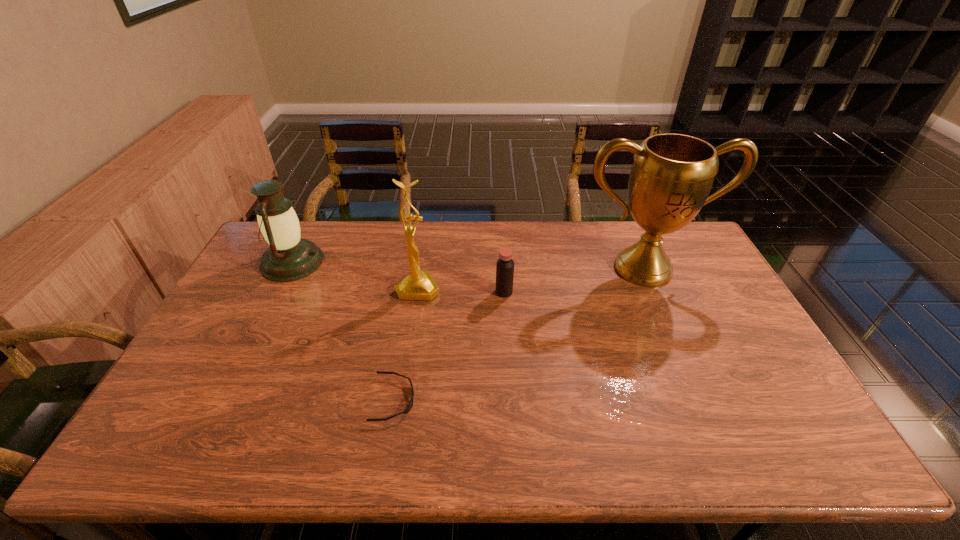
Find the location of `free spot that satisfies the following two spatial constraints: 1. on the surface of the trophy cup with symbols; 2. on the front-facing side of the shortest object`. free spot that satisfies the following two spatial constraints: 1. on the surface of the trophy cup with symbols; 2. on the front-facing side of the shortest object is located at coordinates (700, 400).

Find the location of a particular element. free point that satisfies the following two spatial constraints: 1. on the front-facing side of the fourth shortest object; 2. on the front-facing side of the nearest object is located at coordinates (400, 400).

The width and height of the screenshot is (960, 540). I want to click on vacant point that satisfies the following two spatial constraints: 1. with the light compartment facing forward on the third tallest object; 2. on the right side of the second shortest object, so click(277, 292).